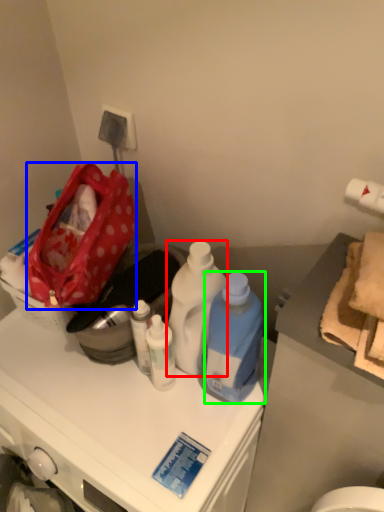
Question: Estimate the real-world distances between objects in this image. Which object is closer to bottle (highlighted by a red box), handbag (highlighted by a blue box) or bottle (highlighted by a green box)?

Choices:
 (A) handbag
 (B) bottle

Answer: (B)